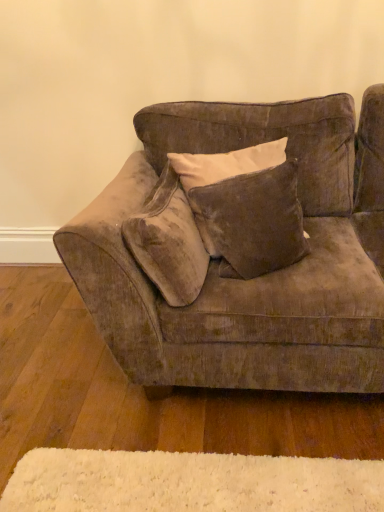
Question: In terms of width, does velvet brown couch at center look wider or thinner when compared to velvet brown pillow at center, the first pillow from the right?

Choices:
 (A) wide
 (B) thin

Answer: (A)

Question: Is velvet brown couch at center in front of or behind velvet brown pillow at center, which appears as the 2th pillow when viewed from the left, in the image?

Choices:
 (A) behind
 (B) front

Answer: (B)

Question: Which object is the closest to the velvet brown pillow at center, the first pillow from the right?

Choices:
 (A) velvet brown couch at center
 (B) velvet beige pillow at center, the first pillow viewed from the left
 (C) white fluffy mat at lower center

Answer: (B)

Question: Considering the real-world distances, which object is farthest from the white fluffy mat at lower center?

Choices:
 (A) velvet brown pillow at center, which appears as the 2th pillow when viewed from the left
 (B) velvet beige pillow at center, the 2th pillow from the right
 (C) velvet brown couch at center

Answer: (A)